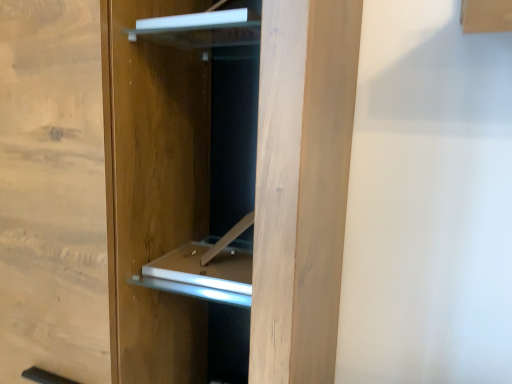
Question: Is point (202, 14) positioned closer to the camera than point (266, 153)?

Choices:
 (A) closer
 (B) farther

Answer: (B)

Question: Is white glossy shelf at upper center wider or thinner than natural wood door at center?

Choices:
 (A) wide
 (B) thin

Answer: (B)

Question: Considering the positions of white glossy shelf at upper center and natural wood door at center in the image, is white glossy shelf at upper center taller or shorter than natural wood door at center?

Choices:
 (A) tall
 (B) short

Answer: (B)

Question: Is natural wood door at center spatially inside white glossy shelf at upper center, or outside of it?

Choices:
 (A) outside
 (B) inside

Answer: (A)

Question: Looking at their shapes, would you say natural wood door at center is wider or thinner than white glossy shelf at upper center?

Choices:
 (A) thin
 (B) wide

Answer: (B)

Question: Visually, is natural wood door at center positioned to the left or to the right of white glossy shelf at upper center?

Choices:
 (A) right
 (B) left

Answer: (B)

Question: From a real-world perspective, is natural wood door at center physically located above or below white glossy shelf at upper center?

Choices:
 (A) below
 (B) above

Answer: (A)